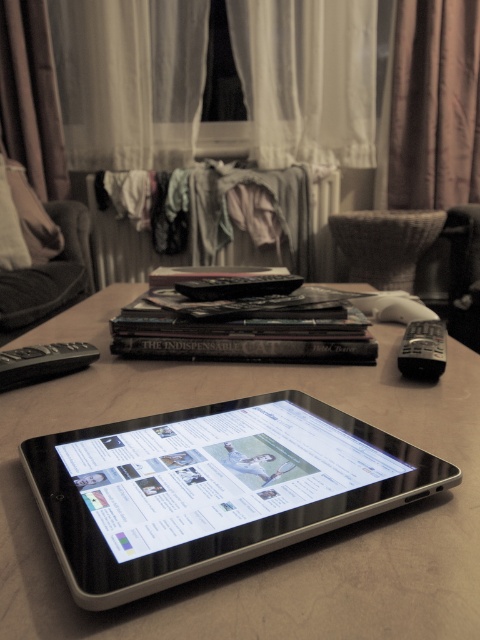
You are trying to pick up the satin black tablet at center and the black plastic remote at left from the table. Which object will you need to reach further to grab?

The black plastic remote at left is further away from the viewer than the satin black tablet at center, so you will need to reach further to grab the black plastic remote at left.

You are standing in the living room and see the satin black tablet at center. If you want to place a small object at the coordinates point (279, 550), where would that be?

The coordinates point (279, 550) correspond to the satin black tablet at center, so placing the object there would place it directly on the tablet.